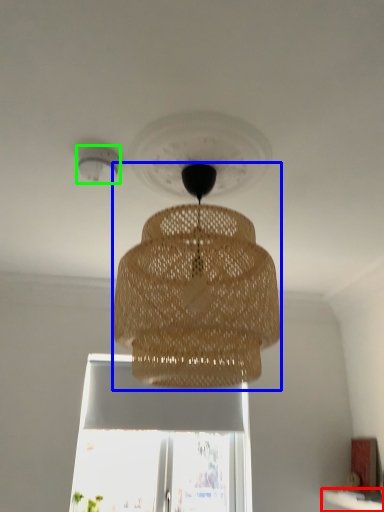
Question: Which object is positioned closest to window sill (highlighted by a red box)? Select from lamp (highlighted by a blue box) and lighting (highlighted by a green box).

Choices:
 (A) lamp
 (B) lighting

Answer: (A)